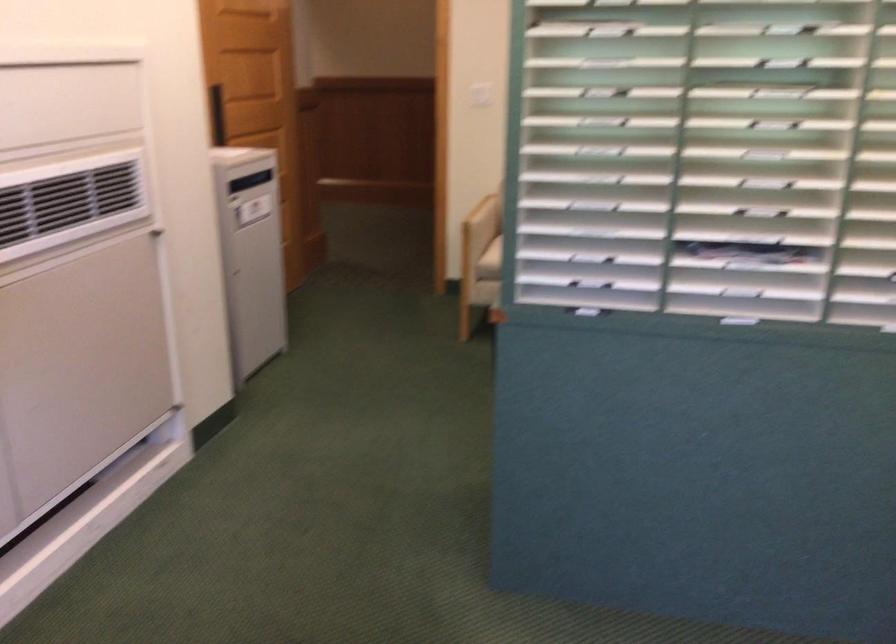
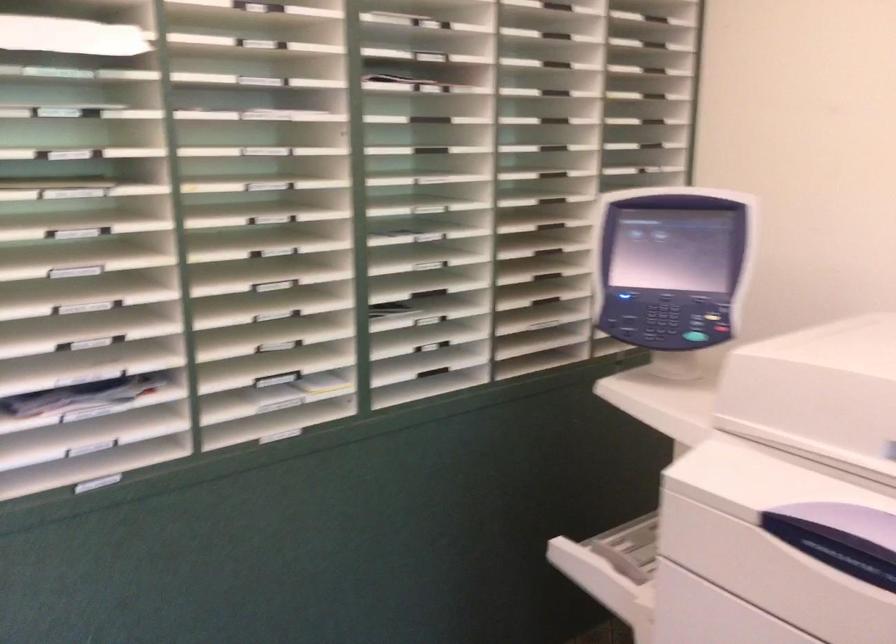
Question: The camera is either moving clockwise (left) or counter-clockwise (right) around the object. The first image is from the beginning of the video and the second image is from the end. Is the camera moving left or right when shooting the video?

Choices:
 (A) Left
 (B) Right

Answer: (A)